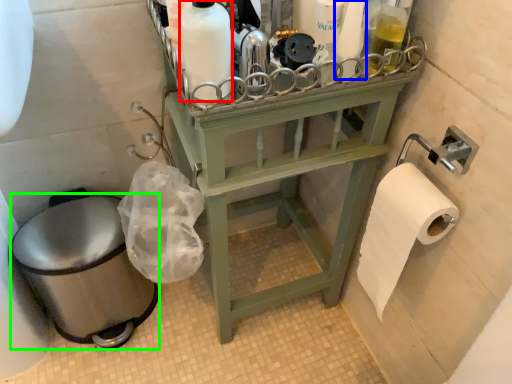
Question: Estimate the real-world distances between objects in this image. Which object is closer to cleaning product (highlighted by a red box), toiletry (highlighted by a blue box) or toilet bowl (highlighted by a green box)?

Choices:
 (A) toiletry
 (B) toilet bowl

Answer: (A)